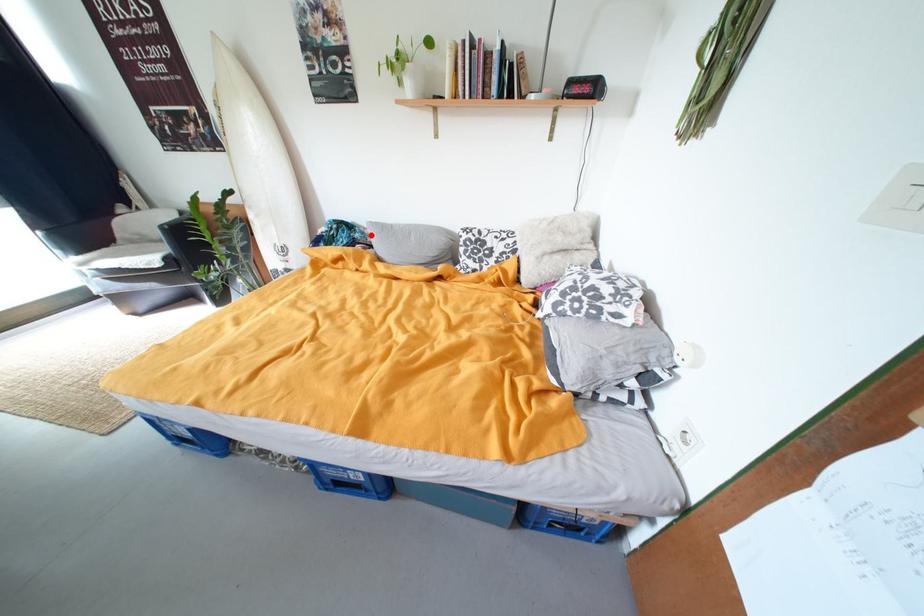
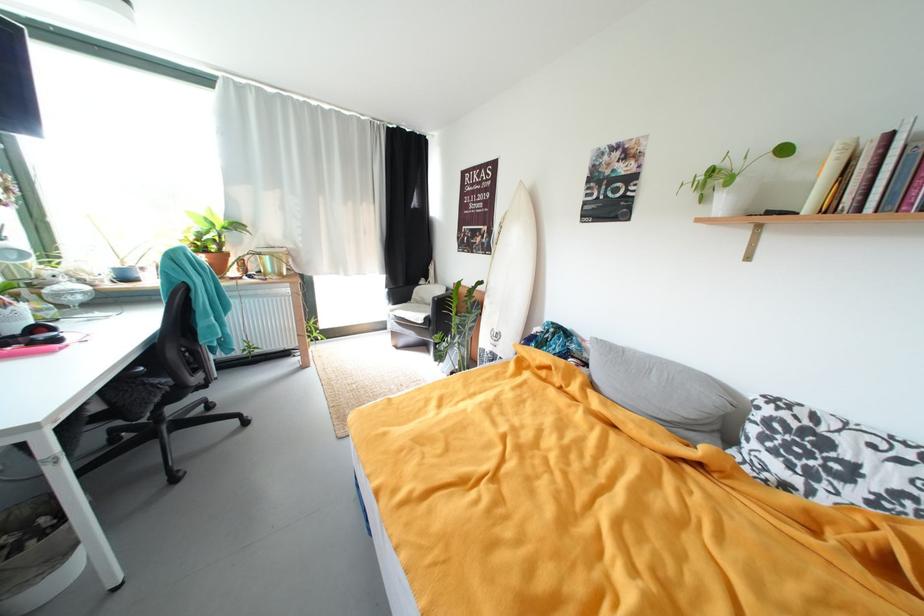
Question: I am providing you with two images of the same scene from different viewpoints. A red point is marked on the first image. Is the red point's position out of view in image 2?

Choices:
 (A) Yes
 (B) No

Answer: (B)